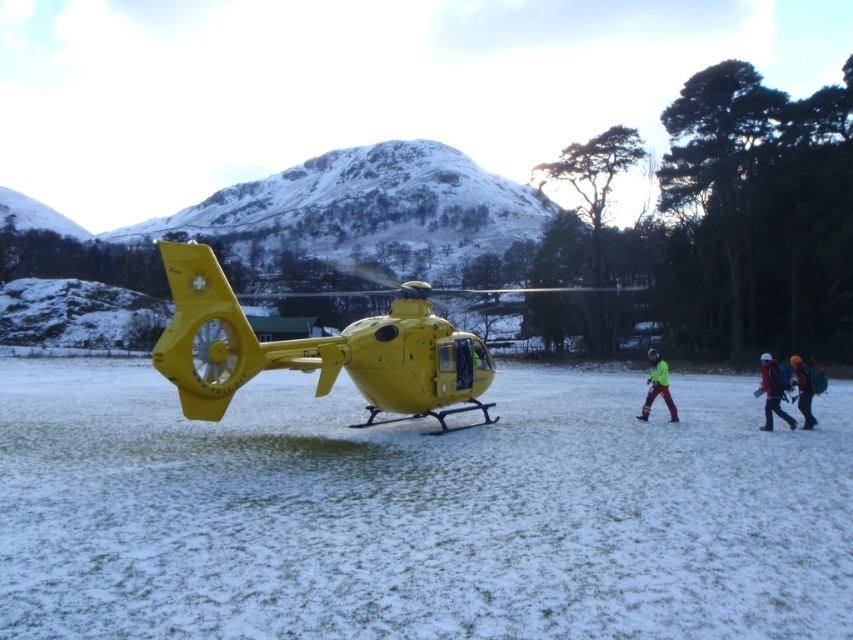
You are a rescue worker who needs to reach the red fabric jacket at lower right from the yellow matte helicopter at center. Can you walk directly to it without any obstacles? The path is flat and clear. The average walking speed of a rescue worker is 1.5 meters per second. How many seconds will it take to reach the jacket?

The distance between the yellow matte helicopter at center and the red fabric jacket at lower right is 14.53 meters. At a walking speed of 1.5 meters per second, it would take approximately 9.69 seconds to reach the jacket. Since the path is flat and clear, there are no obstacles in the way.